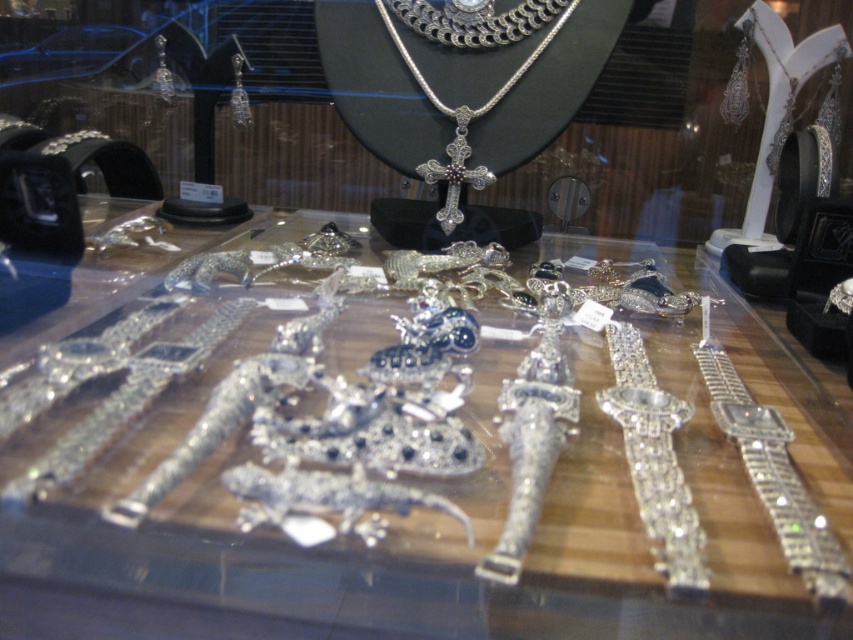
You are a customer at a jewelry store and want to buy a piece that takes up more space in the display case. Which item between the sparkling silver watch at center and the shiny silver necklace at center should you choose?

The shiny silver necklace at center occupies more space than the sparkling silver watch at center, so you should choose the shiny silver necklace at center.